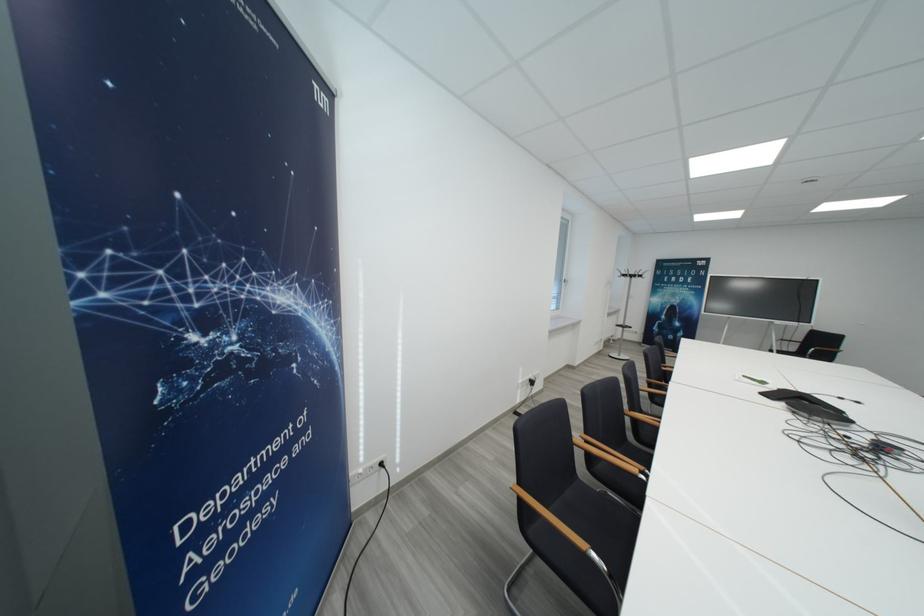
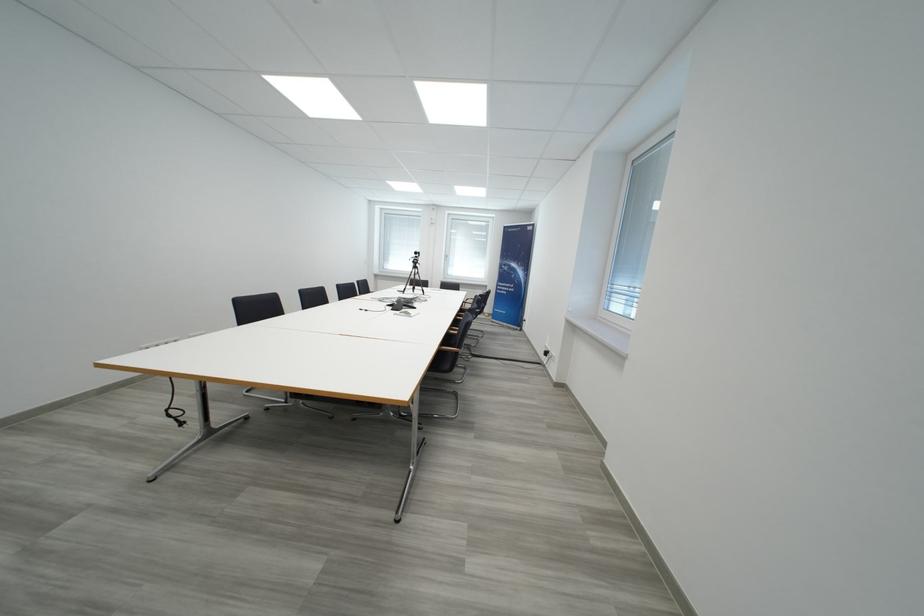
Question: I am providing you with two images of the same scene from different viewpoints. Which of the following objects are not visible in image2?

Choices:
 (A) black rectangular device
 (B) black chair sitting surface
 (C) camera on tripod
 (D) black power plug

Answer: (B)